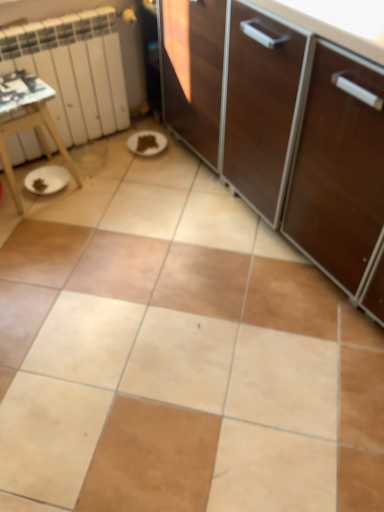
You are a GUI agent. You are given a task and a screenshot of the screen. Output one action in this format:
    pyautogui.click(x=<x>, y=<y>)
    Task: Click on the free area in between white wooden table at left and white matte radiator at left
    
    Given the screenshot: What is the action you would take?
    pyautogui.click(x=97, y=162)